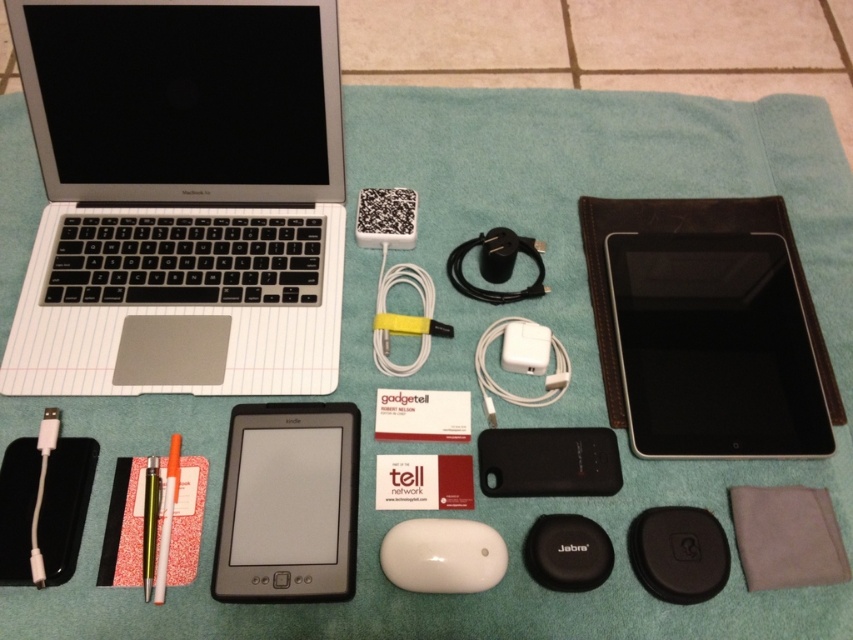
You are setting up a presentation and need to place your black matte tablet at center so it is visible to the audience. The black leather tablet at upper right is blocking the view. How can you adjust their positions?

Move the black leather tablet at upper right to the side so the black matte tablet at center is no longer blocked.

You are setting up a new workspace and want to place a wireless charger exactly in the middle of the black matte tablet at center. According to the coordinates provided, where should you position the wireless charger relative to the tablet?

The wireless charger should be placed at the center point of the black matte tablet at center, which is at coordinates point (288, 502).

You are a photographer setting up a shot of the electronic devices on the teal towel. You want to focus on the point at point (155, 380) and point (502, 566). Which point is closer to your camera?

Point (155, 380) is further to the camera than point (502, 566), so the point at point (502, 566) is closer to the camera.